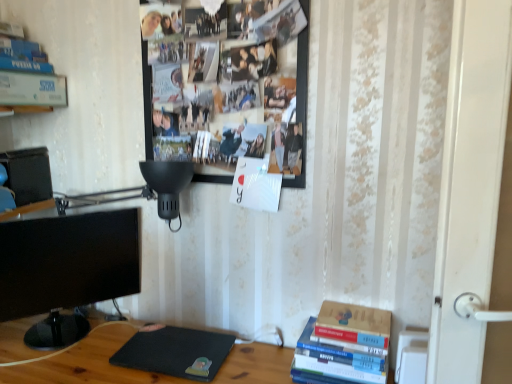
This screenshot has height=384, width=512. Find the location of `vacant area on top of hardcover books at lower right (from a real-world perspective)`. vacant area on top of hardcover books at lower right (from a real-world perspective) is located at coordinates (338, 343).